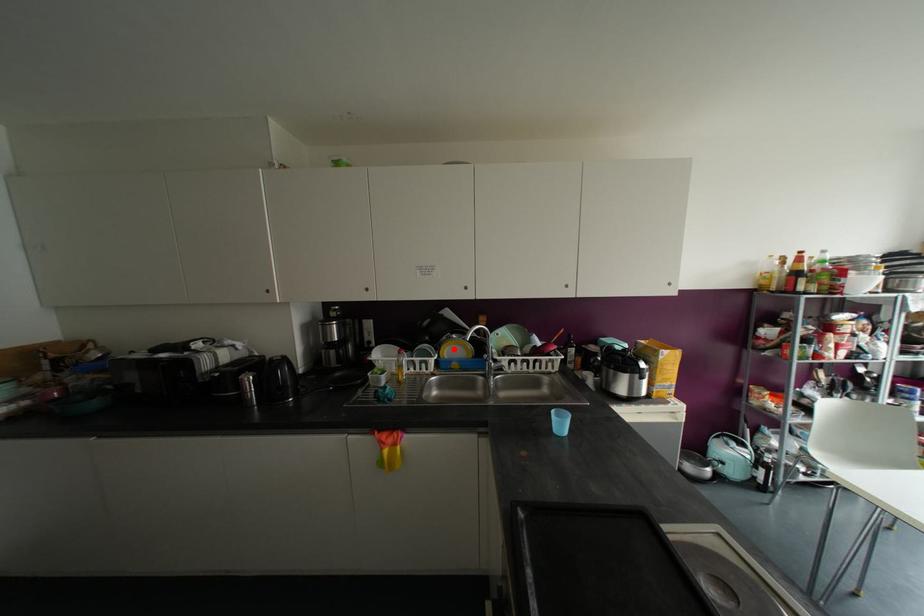
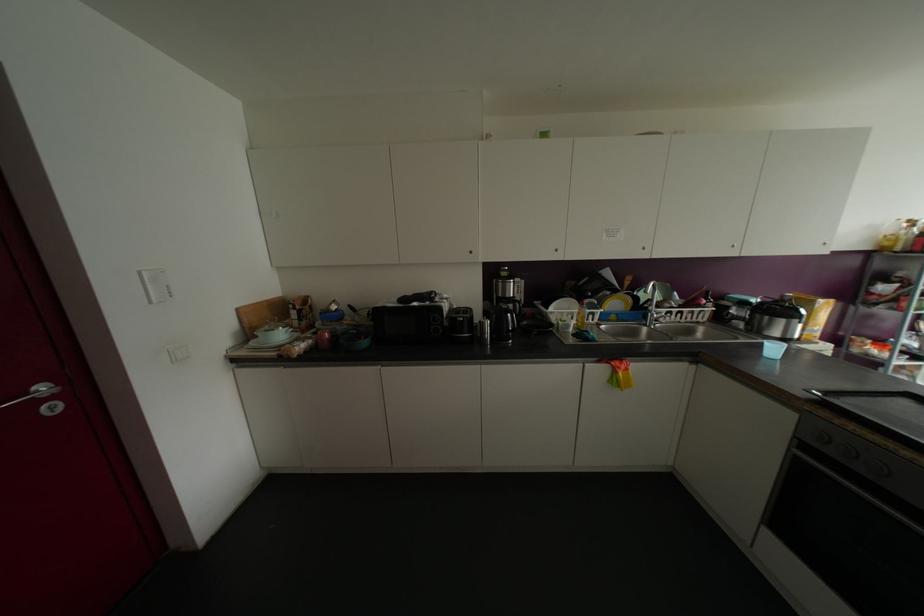
In the second image, find the point that corresponds to the highlighted location in the first image.

(614, 302)